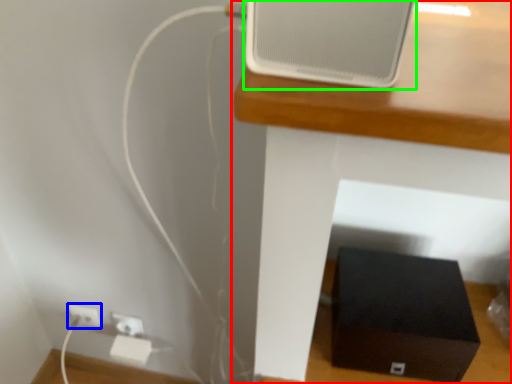
Question: Estimate the real-world distances between objects in this image. Which object is farther from furniture (highlighted by a red box), electric outlet (highlighted by a blue box) or ipod (highlighted by a green box)?

Choices:
 (A) electric outlet
 (B) ipod

Answer: (A)